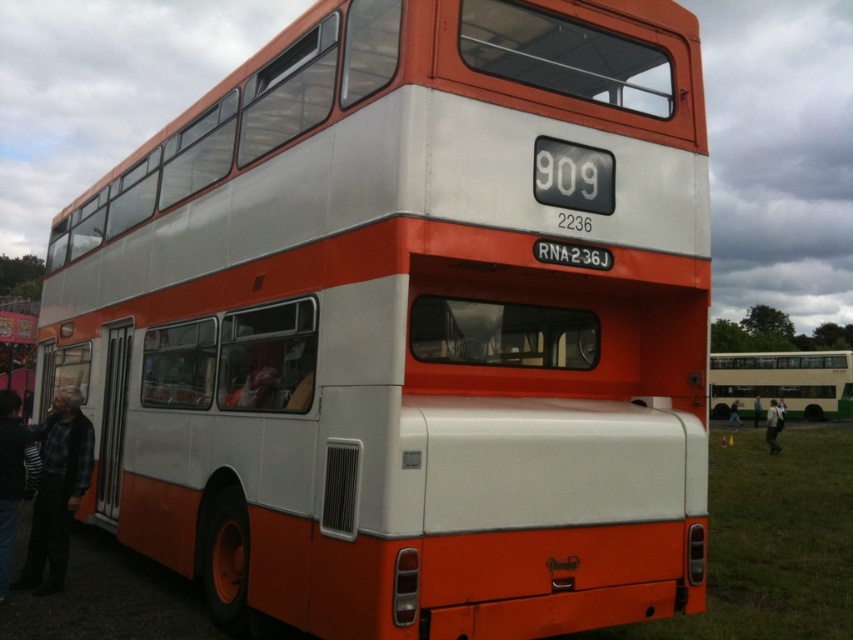
Question: Is dark gray sweater at lower left to the right of dark gray fabric jacket at lower right from the viewer's perspective?

Choices:
 (A) no
 (B) yes

Answer: (A)

Question: Which point is farther to the camera?

Choices:
 (A) flannel shirt at left
 (B) dark gray sweater at lower left
 (C) light blue jeans at lower right

Answer: (C)

Question: Which point is farther to the camera?

Choices:
 (A) dark gray sweater at lower left
 (B) light blue jeans at lower right

Answer: (B)

Question: Estimate the real-world distances between objects in this image. Which object is farther from the white fabric shirt at lower right?

Choices:
 (A) light blue jeans at lower right
 (B) flannel shirt at left

Answer: (B)

Question: Does flannel shirt at left appear on the right side of beige fabric bus at center?

Choices:
 (A) yes
 (B) no

Answer: (B)

Question: Can you confirm if dark gray sweater at lower left is bigger than dark gray fabric jacket at lower right?

Choices:
 (A) no
 (B) yes

Answer: (A)